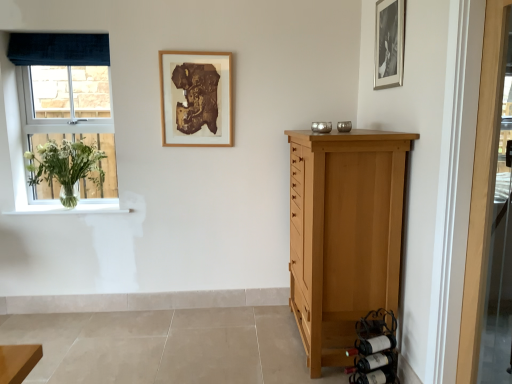
Find the location of a particular element. This screenshot has width=512, height=384. white glossy window sill at left is located at coordinates (72, 210).

What do you see at coordinates (482, 190) in the screenshot? The height and width of the screenshot is (384, 512). I see `wooden door at right` at bounding box center [482, 190].

Measure the distance between point (x=362, y=383) and camera.

2.37 meters.

What do you see at coordinates (373, 377) in the screenshot? This screenshot has width=512, height=384. I see `dark brown glass wine bottle at lower right, marked as the 1th wine bottle in a bottom-to-top arrangement` at bounding box center [373, 377].

Identify the location of black matte picture frame at upper right, acting as the 2th picture frame starting from the back. The width and height of the screenshot is (512, 384). (389, 43).

I want to click on white glossy window sill at left, so click(x=72, y=210).

Does blue velvet window at left come behind black matte picture frame at upper right, which ranks as the 1th picture frame in right-to-left order?

Yes, it is behind black matte picture frame at upper right, which ranks as the 1th picture frame in right-to-left order.

From the image's perspective, which one is positioned lower, blue velvet window at left or black matte picture frame at upper right, which appears as the 2th picture frame when viewed from the left?

blue velvet window at left appears lower in the image.

From a real-world perspective, is blue velvet window at left physically above black matte picture frame at upper right, which appears as the 2th picture frame when viewed from the left?

No.

Could you tell me if blue velvet window at left is turned towards black matte picture frame at upper right, which appears as the 2th picture frame when viewed from the left?

No.

Which object is thinner, dark red glass wine bottle at lower right, which appears as the second wine bottle when ordered from the bottom, or light brown wood chest of drawers at right?

With smaller width is dark red glass wine bottle at lower right, which appears as the second wine bottle when ordered from the bottom.

From the image's perspective, which is above, dark red glass wine bottle at lower right, which appears as the second wine bottle when ordered from the bottom, or light brown wood chest of drawers at right?

light brown wood chest of drawers at right.

Relative to light brown wood chest of drawers at right, is dark red glass wine bottle at lower right, which is counted as the 2th wine bottle, starting from the top, in front or behind?

Clearly, dark red glass wine bottle at lower right, which is counted as the 2th wine bottle, starting from the top, is behind light brown wood chest of drawers at right.

Between point (71, 60) and point (17, 52), which one is positioned in front?

The point (17, 52) is in front.

Does blue velvet window at left have a lesser height compared to dark blue velvet curtain at upper left?

In fact, blue velvet window at left may be taller than dark blue velvet curtain at upper left.

Where is `curtain that is above the blue velvet window at left (from the image's perspective)`? The height and width of the screenshot is (384, 512). curtain that is above the blue velvet window at left (from the image's perspective) is located at coordinates (59, 49).

Which of these two, blue velvet window at left or dark blue velvet curtain at upper left, is thinner?

With smaller width is blue velvet window at left.

Considering the positions of point (66, 158) and point (493, 110), is point (66, 158) closer or farther from the camera than point (493, 110)?

Point (66, 158) appears to be farther away from the viewer than point (493, 110).

From a real-world perspective, which object stands above the other?

In real-world perspective, clear glass vase at left is above.

From the image's perspective, is clear glass vase at left located above wooden door at right?

Yes, from the image's perspective, clear glass vase at left is above wooden door at right.

Considering the sizes of clear glass vase at left and wooden door at right in the image, is clear glass vase at left wider or thinner than wooden door at right?

In the image, clear glass vase at left appears to be wider than wooden door at right.

Would you say light brown wood chest of drawers at right contains clear glass vase at left?

That's incorrect, clear glass vase at left is not inside light brown wood chest of drawers at right.

Is light brown wood chest of drawers at right thinner than clear glass vase at left?

No, light brown wood chest of drawers at right is not thinner than clear glass vase at left.

Does light brown wood chest of drawers at right turn towards clear glass vase at left?

Yes, light brown wood chest of drawers at right faces towards clear glass vase at left.

From a real-world perspective, who is located lower, black matte picture frame at upper right, acting as the 2th picture frame starting from the back, or dark brown glass wine bottle at lower right, which appears as the 3th wine bottle when viewed from the top?

From a 3D spatial view, dark brown glass wine bottle at lower right, which appears as the 3th wine bottle when viewed from the top, is below.

Is black matte picture frame at upper right, which appears as the 2th picture frame when viewed from the left, positioned beyond the bounds of dark brown glass wine bottle at lower right, marked as the 1th wine bottle in a bottom-to-top arrangement?

Yes, black matte picture frame at upper right, which appears as the 2th picture frame when viewed from the left, is not within dark brown glass wine bottle at lower right, marked as the 1th wine bottle in a bottom-to-top arrangement.

Can you confirm if black matte picture frame at upper right, which appears as the 2th picture frame when viewed from the left, is wider than dark brown glass wine bottle at lower right, which appears as the 3th wine bottle when viewed from the top?

No, black matte picture frame at upper right, which appears as the 2th picture frame when viewed from the left, is not wider than dark brown glass wine bottle at lower right, which appears as the 3th wine bottle when viewed from the top.

Is black matte picture frame at upper right, which appears as the 2th picture frame when viewed from the left, facing away from wooden door at right?

No, black matte picture frame at upper right, which appears as the 2th picture frame when viewed from the left, is not facing away from wooden door at right.

Can you confirm if black matte picture frame at upper right, which is the 1th picture frame in front-to-back order, is bigger than wooden door at right?

No.

Does black matte picture frame at upper right, which ranks as the 1th picture frame in right-to-left order, have a greater height compared to wooden door at right?

No.

Which object is further away from the camera, black matte picture frame at upper right, which ranks as the 1th picture frame in right-to-left order, or wooden door at right?

black matte picture frame at upper right, which ranks as the 1th picture frame in right-to-left order, is behind.

The height and width of the screenshot is (384, 512). I want to click on window to the left of black matte picture frame at upper right, which appears as the 2th picture frame when viewed from the left, so tap(66, 110).

Where is `chest of drawers above the dark red glass wine bottle at lower right, which is counted as the 2th wine bottle, starting from the top (from the image's perspective)`? The image size is (512, 384). chest of drawers above the dark red glass wine bottle at lower right, which is counted as the 2th wine bottle, starting from the top (from the image's perspective) is located at coordinates (344, 234).

Looking at the image, which one is located further to wooden door at right, clear glass vase at left or blue velvet window at left?

Among the two, blue velvet window at left is located further to wooden door at right.

Estimate the real-world distances between objects in this image. Which object is closer to blue velvet window at left, dark blue velvet curtain at upper left or wooden door at right?

dark blue velvet curtain at upper left is closer to blue velvet window at left.

Looking at the image, which one is located further to wooden picture frame at upper center, which is the 2th picture frame in right-to-left order, light brown wood chest of drawers at right or dark blue velvet curtain at upper left?

light brown wood chest of drawers at right lies further to wooden picture frame at upper center, which is the 2th picture frame in right-to-left order, than the other object.

When comparing their distances from wooden door at right, does matte black wine bottle at lower right, positioned as the first wine bottle in top-to-bottom order, or light brown wood chest of drawers at right seem further?

matte black wine bottle at lower right, positioned as the first wine bottle in top-to-bottom order, is further to wooden door at right.

Looking at the image, which one is located further to blue velvet window at left, dark blue velvet curtain at upper left or clear glass vase at left?

Based on the image, dark blue velvet curtain at upper left appears to be further to blue velvet window at left.

Looking at the image, which one is located further to matte black wine bottle at lower right, positioned as the first wine bottle in top-to-bottom order, clear glass vase at left or black matte picture frame at upper right, acting as the 2th picture frame starting from the back?

Among the two, clear glass vase at left is located further to matte black wine bottle at lower right, positioned as the first wine bottle in top-to-bottom order.

Looking at the image, which one is located further to wooden picture frame at upper center, the 2th picture frame viewed from the front, dark brown glass wine bottle at lower right, which appears as the 3th wine bottle when viewed from the top, or matte black wine bottle at lower right, which is the third wine bottle from bottom to top?

Based on the image, dark brown glass wine bottle at lower right, which appears as the 3th wine bottle when viewed from the top, appears to be further to wooden picture frame at upper center, the 2th picture frame viewed from the front.

From the image, which object appears to be farther from white glossy window sill at left, black matte picture frame at upper right, acting as the 2th picture frame starting from the back, or blue velvet window at left?

Based on the image, black matte picture frame at upper right, acting as the 2th picture frame starting from the back, appears to be further to white glossy window sill at left.

This screenshot has height=384, width=512. What are the coordinates of `wine bottle between clear glass vase at left and dark brown glass wine bottle at lower right, which appears as the 3th wine bottle when viewed from the top` in the screenshot? It's located at (376, 361).

The width and height of the screenshot is (512, 384). I want to click on wine bottle between blue velvet window at left and dark brown glass wine bottle at lower right, which appears as the 3th wine bottle when viewed from the top, from left to right, so click(x=376, y=361).

Find the location of `picture frame situated between white glossy window sill at left and matte black wine bottle at lower right, positioned as the first wine bottle in top-to-bottom order, from left to right`. picture frame situated between white glossy window sill at left and matte black wine bottle at lower right, positioned as the first wine bottle in top-to-bottom order, from left to right is located at coordinates (196, 98).

I want to click on curtain situated between blue velvet window at left and light brown wood chest of drawers at right from left to right, so click(59, 49).